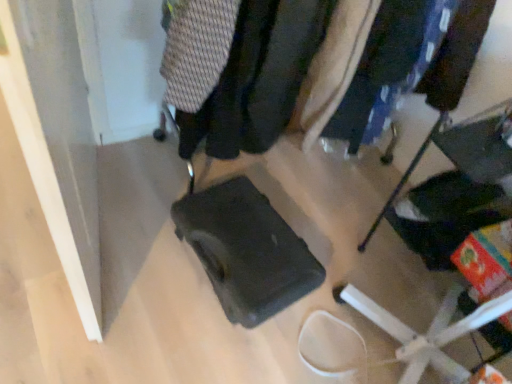
Question: Does matte black suitcase at center have a lesser width compared to knitted fabric sweater at upper center, the second clothing positioned from the right?

Choices:
 (A) yes
 (B) no

Answer: (A)

Question: Are matte black suitcase at center and knitted fabric sweater at upper center, the second clothing positioned from the right, beside each other?

Choices:
 (A) no
 (B) yes

Answer: (A)

Question: Is matte black suitcase at center taller than knitted fabric sweater at upper center, which is the 1th clothing in left-to-right order?

Choices:
 (A) no
 (B) yes

Answer: (B)

Question: Are matte black suitcase at center and knitted fabric sweater at upper center, the second clothing positioned from the right, located far from each other?

Choices:
 (A) yes
 (B) no

Answer: (B)

Question: Is matte black suitcase at center positioned beyond the bounds of knitted fabric sweater at upper center, which is the 1th clothing in left-to-right order?

Choices:
 (A) no
 (B) yes

Answer: (B)

Question: From the image's perspective, is matte black suitcase at center above or below knitted fabric sweater at upper center, which is the 1th clothing in left-to-right order?

Choices:
 (A) below
 (B) above

Answer: (A)

Question: Is matte black suitcase at center bigger or smaller than knitted fabric sweater at upper center, which is the 1th clothing in left-to-right order?

Choices:
 (A) small
 (B) big

Answer: (B)

Question: Is matte black suitcase at center to the left or to the right of knitted fabric sweater at upper center, the second clothing positioned from the right, in the image?

Choices:
 (A) right
 (B) left

Answer: (A)

Question: Considering the positions of matte black suitcase at center and knitted fabric sweater at upper center, which is the 1th clothing in left-to-right order, in the image, is matte black suitcase at center wider or thinner than knitted fabric sweater at upper center, which is the 1th clothing in left-to-right order,?

Choices:
 (A) thin
 (B) wide

Answer: (A)

Question: Is matte black backpack at center, which is the second clothing from left to right, taller or shorter than matte black suitcase at center?

Choices:
 (A) tall
 (B) short

Answer: (B)

Question: Considering the positions of matte black backpack at center, which is the second clothing from left to right, and matte black suitcase at center in the image, is matte black backpack at center, which is the second clothing from left to right, bigger or smaller than matte black suitcase at center?

Choices:
 (A) small
 (B) big

Answer: (A)

Question: Does point (294, 64) appear closer or farther from the camera than point (403, 349)?

Choices:
 (A) farther
 (B) closer

Answer: (B)

Question: From a real-world perspective, is matte black backpack at center, marked as the 1th clothing in a right-to-left arrangement, physically located above or below matte black suitcase at center?

Choices:
 (A) below
 (B) above

Answer: (A)

Question: Considering the positions of matte black suitcase at center and matte black backpack at center, which is the second clothing from left to right, in the image, is matte black suitcase at center taller or shorter than matte black backpack at center, which is the second clothing from left to right,?

Choices:
 (A) tall
 (B) short

Answer: (A)

Question: Considering the relative positions of matte black suitcase at center and matte black backpack at center, marked as the 1th clothing in a right-to-left arrangement, in the image provided, is matte black suitcase at center to the left or to the right of matte black backpack at center, marked as the 1th clothing in a right-to-left arrangement,?

Choices:
 (A) right
 (B) left

Answer: (A)